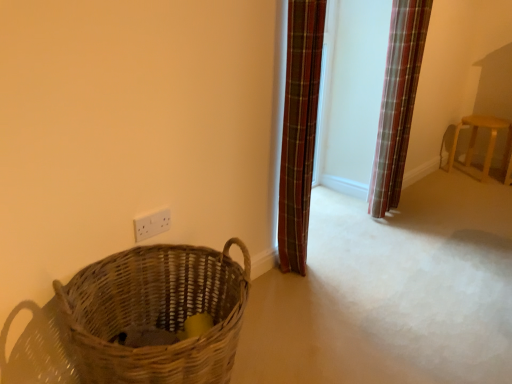
At what (x,y) coordinates should I click in order to perform the action: click on vacant area that lies between plaid fabric curtain at center, positioned as the second curtain in right-to-left order, and woven brown basket at lower left. Please return your answer as a coordinate pair (x, y). Looking at the image, I should click on (278, 312).